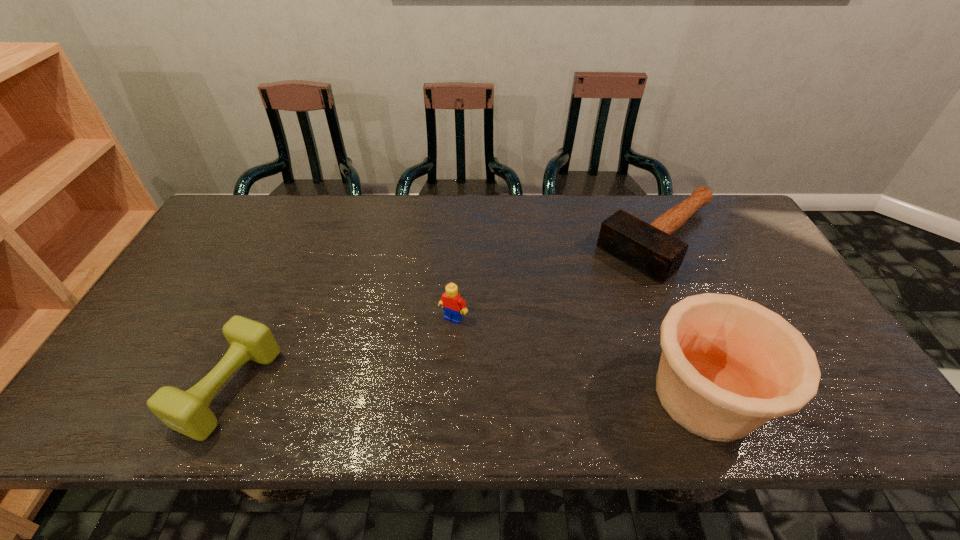
Find the location of a particular element. vacant space on the desktop that is between the leftmost object and the tallest object and is positioned on the hammer head face of the farthest object is located at coordinates (472, 392).

What are the coordinates of `vacant space on the desktop that is between the dumbbell and the pottery and is positioned on the face of the third nearest object` in the screenshot? It's located at (409, 390).